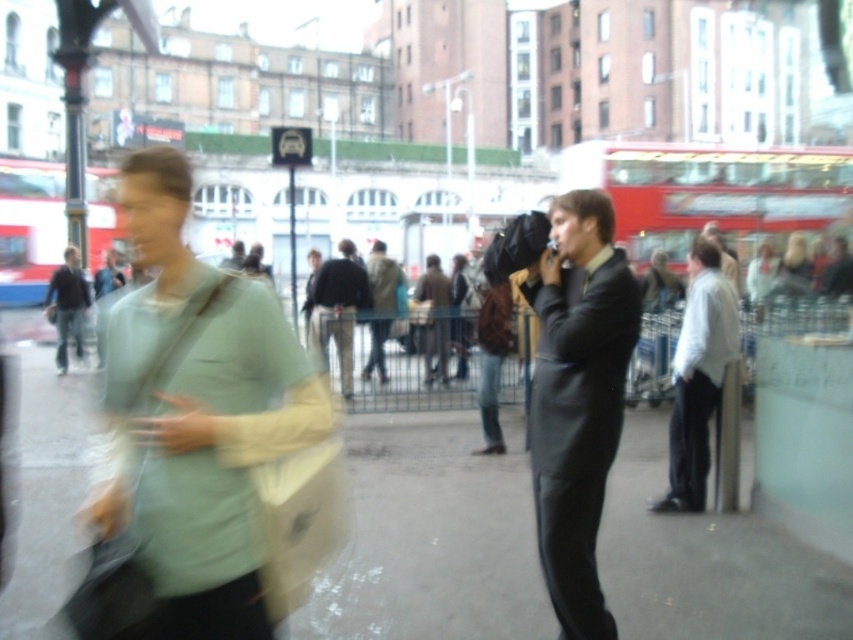
Does smooth concrete pavement at center appear on the left side of light green fabric bag at left?

Indeed, smooth concrete pavement at center is positioned on the left side of light green fabric bag at left.

Is point (524, 465) positioned before point (148, 536)?

No.

This screenshot has height=640, width=853. I want to click on smooth concrete pavement at center, so click(432, 536).

Between smooth concrete pavement at center and brown leather jacket at center, which one is positioned lower?

smooth concrete pavement at center is lower down.

Measure the distance between smooth concrete pavement at center and brown leather jacket at center.

A distance of 4.75 meters exists between smooth concrete pavement at center and brown leather jacket at center.

This screenshot has width=853, height=640. What do you see at coordinates (432, 536) in the screenshot? I see `smooth concrete pavement at center` at bounding box center [432, 536].

At what (x,y) coordinates should I click in order to perform the action: click on smooth concrete pavement at center. Please return your answer as a coordinate pair (x, y). The width and height of the screenshot is (853, 640). Looking at the image, I should click on (432, 536).

What do you see at coordinates (709, 189) in the screenshot? This screenshot has height=640, width=853. I see `red rubber bus at center` at bounding box center [709, 189].

Who is higher up, red rubber bus at center or dark brown leather jacket at center?

red rubber bus at center is higher up.

Between point (688, 176) and point (328, 328), which one is positioned in front?

Positioned in front is point (328, 328).

Find the location of a particular element. Image resolution: width=853 pixels, height=640 pixels. red rubber bus at center is located at coordinates (709, 189).